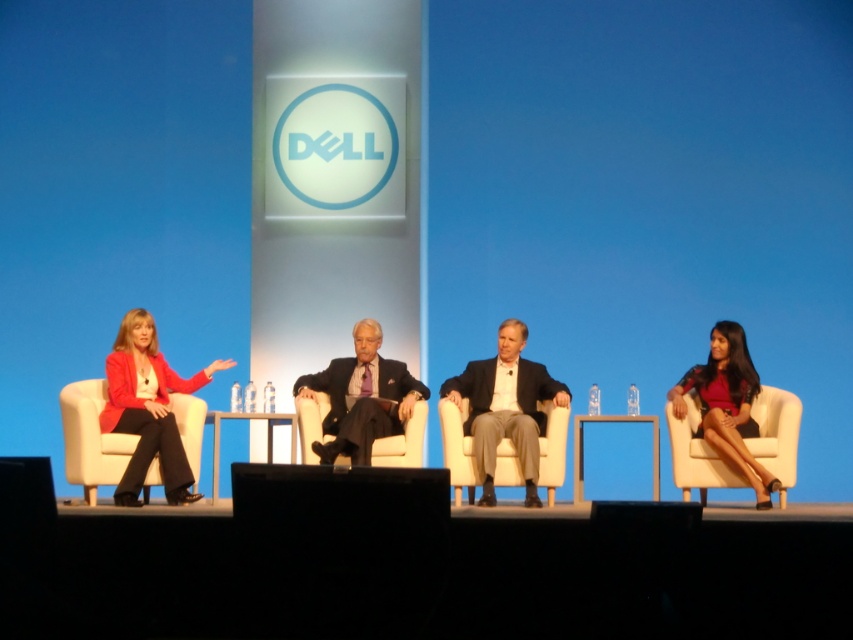
Is matte red blazer at left above white fabric chair at left?

Indeed, matte red blazer at left is positioned over white fabric chair at left.

Can you confirm if matte red blazer at left is wider than white fabric chair at left?

Yes, matte red blazer at left is wider than white fabric chair at left.

Who is more forward, [167,477] or [74,396]?

Point [167,477] is in front.

This screenshot has width=853, height=640. I want to click on matte red blazer at left, so click(148, 408).

Which is in front, point (543, 461) or point (299, 428)?

Point (543, 461) is in front.

Is the position of beige fabric chair at center more distant than that of white fabric chair at center?

That is False.

Is point (517, 460) positioned behind point (323, 442)?

No.

Locate an element on the screen. The width and height of the screenshot is (853, 640). beige fabric chair at center is located at coordinates (457, 448).

Measure the distance between matte red blazer at left and camera.

matte red blazer at left is 23.28 feet from camera.

Can you confirm if matte red blazer at left is positioned below white leather chair at right?

Incorrect, matte red blazer at left is not positioned below white leather chair at right.

The width and height of the screenshot is (853, 640). What do you see at coordinates (148, 408) in the screenshot?
I see `matte red blazer at left` at bounding box center [148, 408].

The image size is (853, 640). Find the location of `matte red blazer at left`. matte red blazer at left is located at coordinates (148, 408).